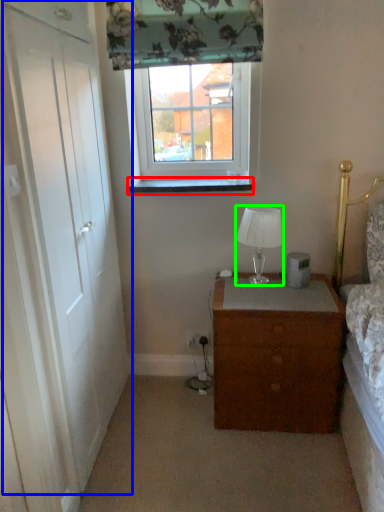
Question: Which object is positioned farthest from window sill (highlighted by a red box)? Select from door (highlighted by a blue box) and lamp (highlighted by a green box).

Choices:
 (A) door
 (B) lamp

Answer: (A)